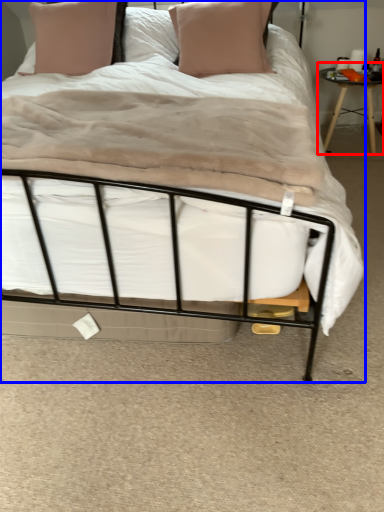
Question: Which object appears farthest to the camera in this image, table (highlighted by a red box) or bed (highlighted by a blue box)?

Choices:
 (A) table
 (B) bed

Answer: (A)